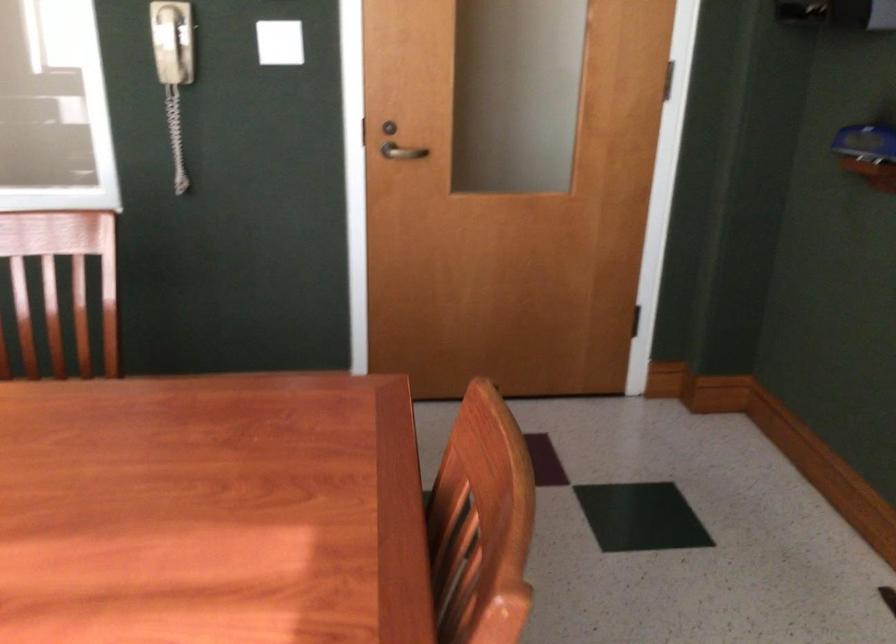
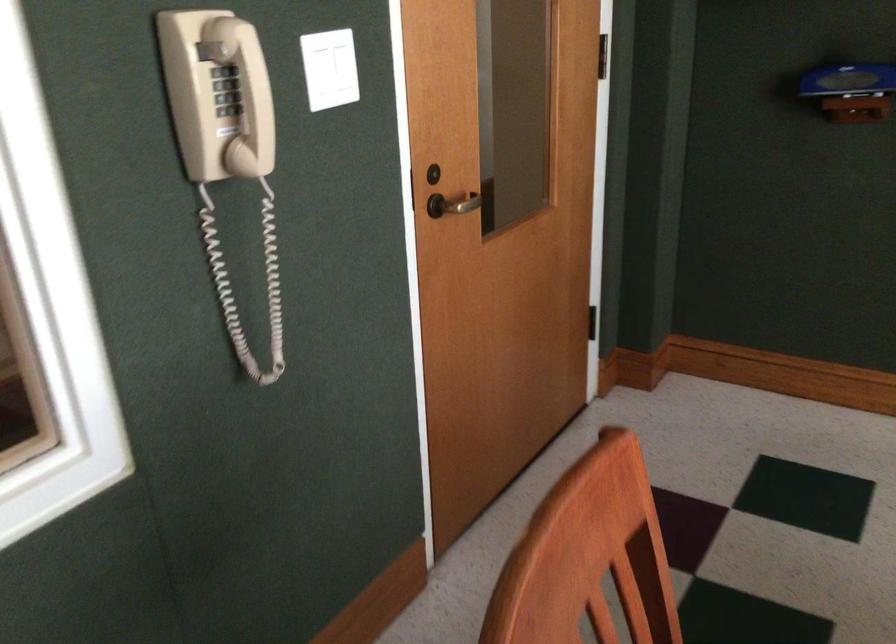
Find the pixel in the second image that matches (392,152) in the first image.

(458, 204)